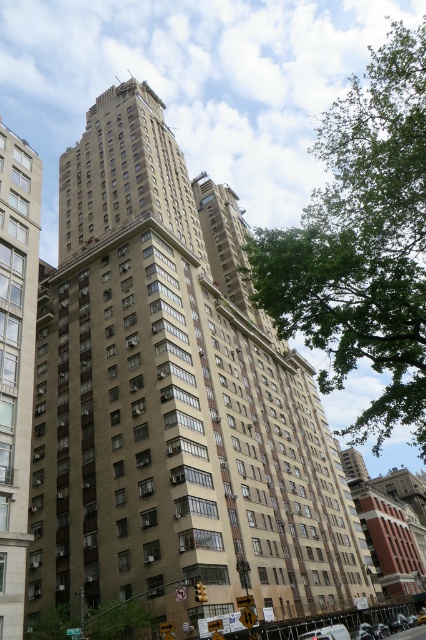
You are standing in front of the residential building and notice two points marked on the facade. The first point is at coordinates point (x=328, y=209) and the second is at point (x=36, y=225). Which point is closer to your current position?

Point (x=328, y=209) is closer to the viewer than point (x=36, y=225).

Please provide the coordinates of the brown brick building at center in the image. The coordinate system is normalized, with the origin at the bottom left corner of the image and the top right corner at point 1.0, 1.0. The coordinates are represented as a tuple of two values between 0.0 and 1.0, like 0.5, 0.5. Please only provide the coordinates in the format of a tuple of two decimal numbers, such as 0.5, 0.5. Do not add any other information.

The coordinates of the brown brick building at center are (x=172, y=401).

You are a drone operator trying to capture a photo of the beige concrete building at left and the green leafy tree at upper right. Based on their sizes, which object should you focus on to ensure both fit in the frame without cropping?

The beige concrete building at left is smaller than the green leafy tree at upper right, so you should focus on capturing the larger green leafy tree at upper right to ensure both fit in the frame without cropping.